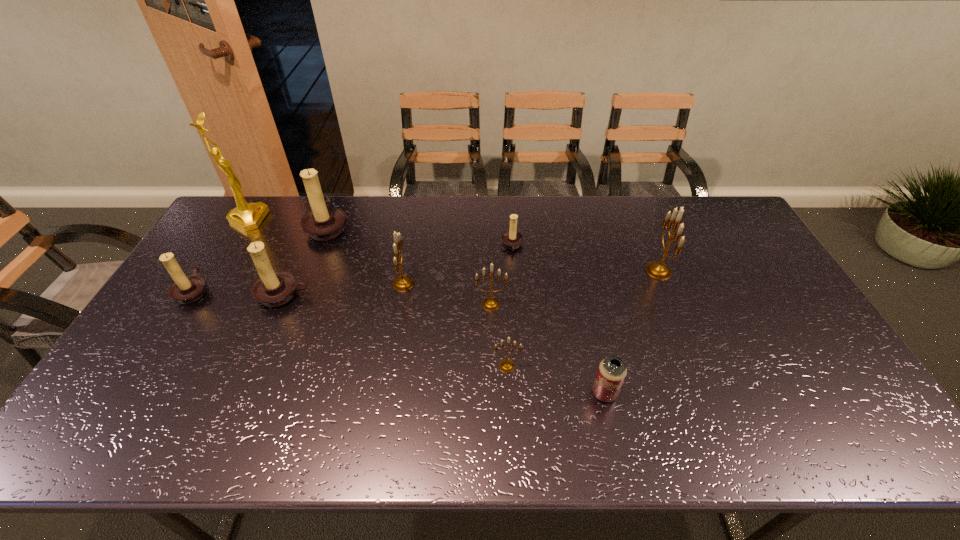
Locate an element on the screen. The image size is (960, 540). the leftmost brown candle holder is located at coordinates (186, 290).

Where is `the smallest brown candle holder`? the smallest brown candle holder is located at coordinates (511, 239).

In order to click on the nearest gold candelabrum in this screenshot , I will do `click(506, 366)`.

The width and height of the screenshot is (960, 540). What are the coordinates of `the nearest candelabrum` in the screenshot? It's located at (506, 366).

At what (x,y) coordinates should I click in order to perform the action: click on red beer can. Please return your answer as a coordinate pair (x, y). Looking at the image, I should click on (612, 371).

This screenshot has width=960, height=540. Identify the location of the ninth object from left to right. (612, 371).

Where is `vacant space located 0.230m on the front-facing side of the award`? vacant space located 0.230m on the front-facing side of the award is located at coordinates (329, 219).

Identify the location of vacant region located 0.060m on the wick of the biggest brown candle holder. (366, 226).

Find the location of `free region located 0.140m on the left of the biggest gold candelabrum`. free region located 0.140m on the left of the biggest gold candelabrum is located at coordinates (602, 271).

At what (x,y) coordinates should I click in order to perform the action: click on free point located on the right of the second biggest gold candelabrum. Please return your answer as a coordinate pair (x, y). Looking at the image, I should click on (476, 284).